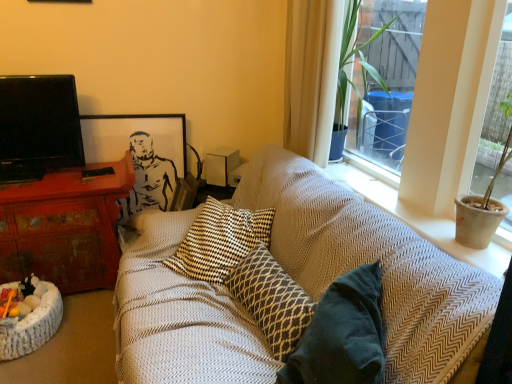
Where is `free space above woven fabric cat bed at lower left (from a real-world perspective)`? The image size is (512, 384). free space above woven fabric cat bed at lower left (from a real-world perspective) is located at coordinates (24, 296).